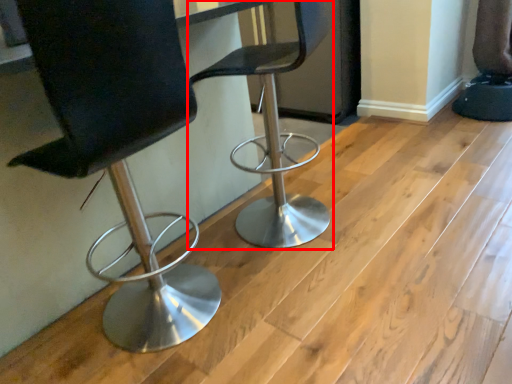
Question: In this image, where is chair (annotated by the red box) located relative to chair?

Choices:
 (A) right
 (B) left

Answer: (A)